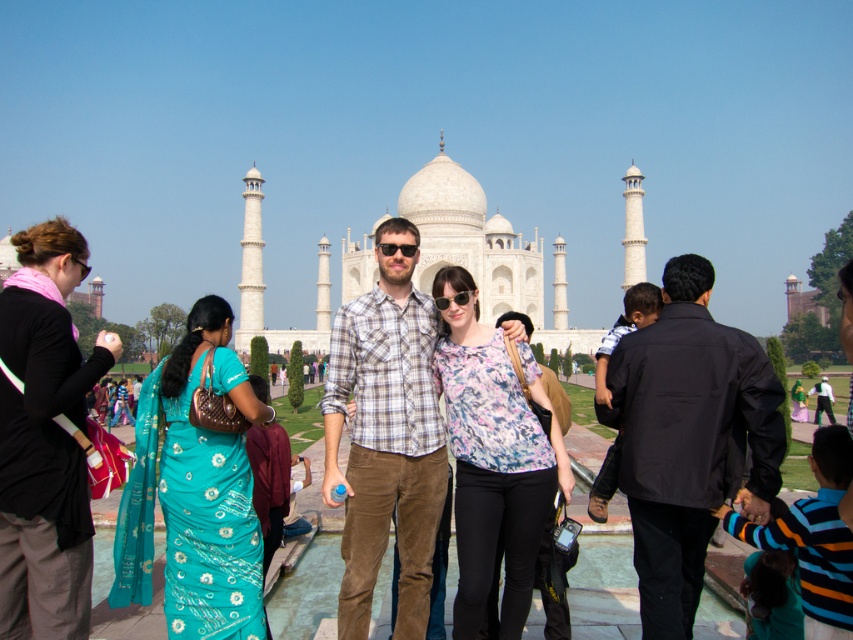
You are a photographer taking a picture of the Taj Mahal. You notice the teal silk saree at left and the floral fabric blouse at center in your frame. Which object is closer to the camera based on their positions?

The teal silk saree at left is positioned under the floral fabric blouse at center, meaning it is closer to the camera.

You are a photographer planning to take a group photo of the teal silk saree at left and the floral fabric blouse at center. Since you want to capture both subjects in the frame, which one should you position closer to the center of the image to ensure both are visible?

The teal silk saree at left is on the left side of the floral fabric blouse at center, so positioning the floral fabric blouse at center closer to the image center will help include both in the frame.

You are standing in front of the Taj Mahal and want to take a photo that includes both the point at coordinates point (401,371) and the point at coordinates point (473,392). Which point should you focus on first to ensure both are in focus?

You should focus on the point at coordinates point (401,371) first because it is closer to you than the point at coordinates point (473,392). By focusing on the closer point, both points will be in focus as the farther one will fall within the depth of field.